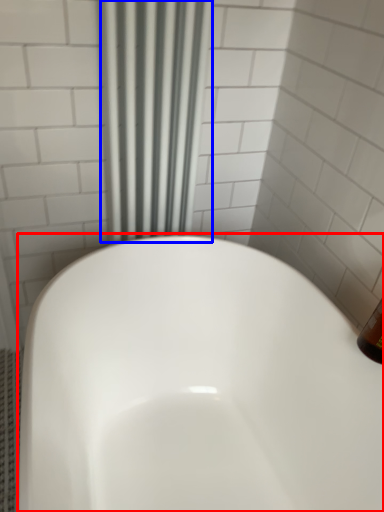
Question: Which object appears closest to the camera in this image, bathtub (highlighted by a red box) or shower curtain (highlighted by a blue box)?

Choices:
 (A) bathtub
 (B) shower curtain

Answer: (A)